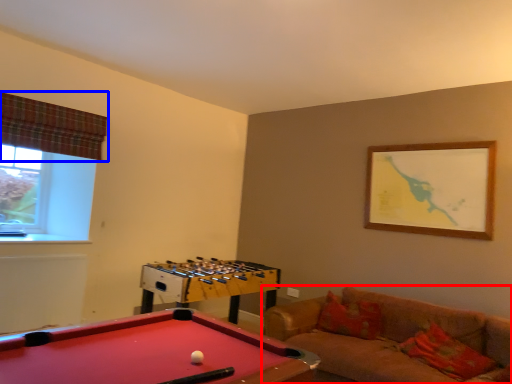
Question: Which point is further to the camera, studio couch (highlighted by a red box) or curtain (highlighted by a blue box)?

Choices:
 (A) studio couch
 (B) curtain

Answer: (B)